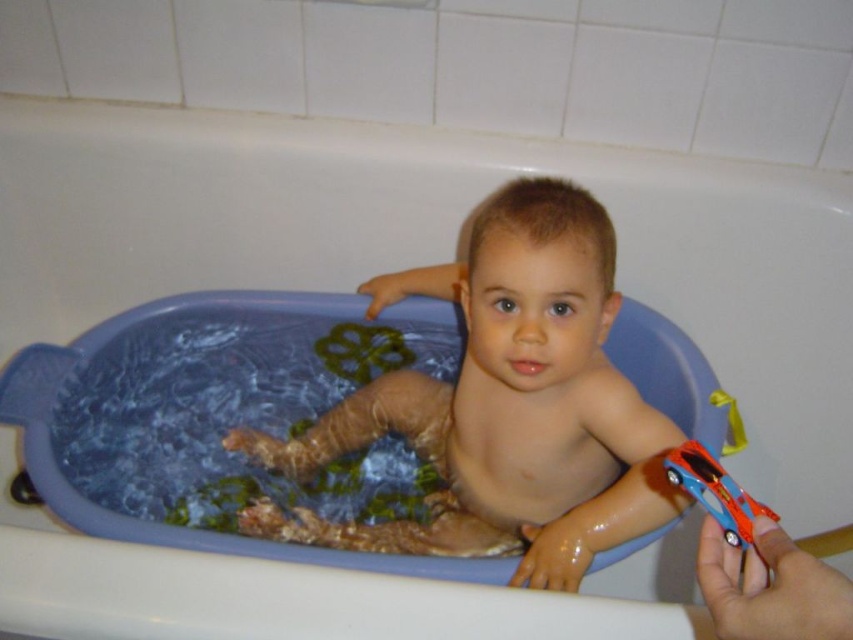
Question: Is smooth skin child at center to the left of shiny plastic car at lower right from the viewer's perspective?

Choices:
 (A) yes
 (B) no

Answer: (A)

Question: Is smooth skin child at center below shiny plastic car at lower right?

Choices:
 (A) yes
 (B) no

Answer: (B)

Question: Which point is closer to the camera?

Choices:
 (A) (625, 468)
 (B) (685, 474)

Answer: (B)

Question: Which of the following is the closest to the observer?

Choices:
 (A) (695, 445)
 (B) (630, 384)

Answer: (A)

Question: Which object appears closest to the camera in this image?

Choices:
 (A) shiny plastic car at lower right
 (B) smooth skin child at center

Answer: (A)

Question: Observing the image, what is the correct spatial positioning of smooth skin child at center in reference to shiny plastic car at lower right?

Choices:
 (A) above
 (B) below

Answer: (A)